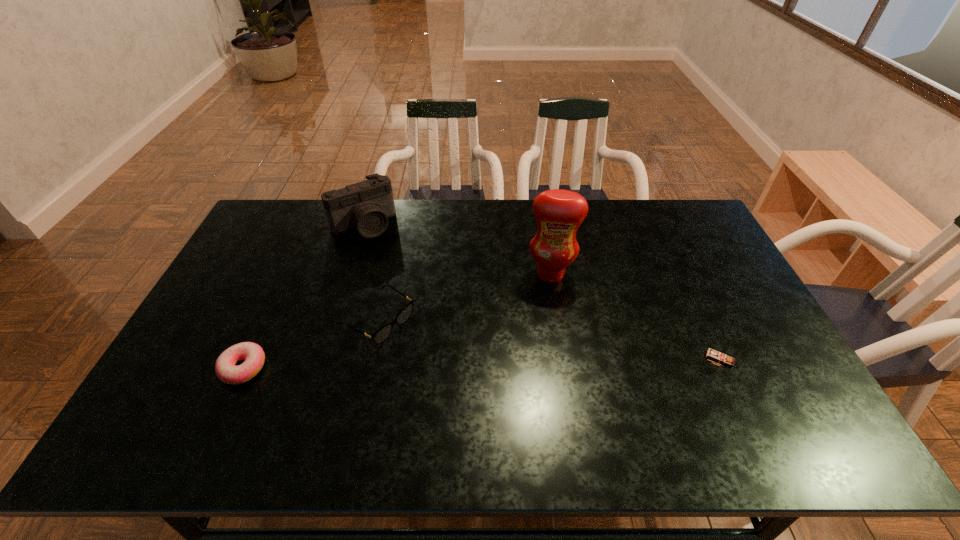
The image size is (960, 540). Identify the location of doughnut. (252, 353).

Where is `the shortest object`? This screenshot has width=960, height=540. the shortest object is located at coordinates (252, 353).

Find the location of a particular element. The width and height of the screenshot is (960, 540). the third shortest object is located at coordinates (721, 355).

Locate an element on the screen. This screenshot has height=540, width=960. the rightmost object is located at coordinates (x=721, y=355).

Where is `spectacles`? Image resolution: width=960 pixels, height=540 pixels. spectacles is located at coordinates (383, 333).

Locate an element on the screen. The width and height of the screenshot is (960, 540). condiment is located at coordinates (559, 213).

This screenshot has height=540, width=960. In order to click on the tallest object in this screenshot , I will do `click(559, 213)`.

In order to click on the farthest object in this screenshot , I will do `click(366, 206)`.

Locate an element on the screen. camera is located at coordinates (366, 206).

I want to click on free space located 0.290m on the right of the leftmost object, so click(376, 368).